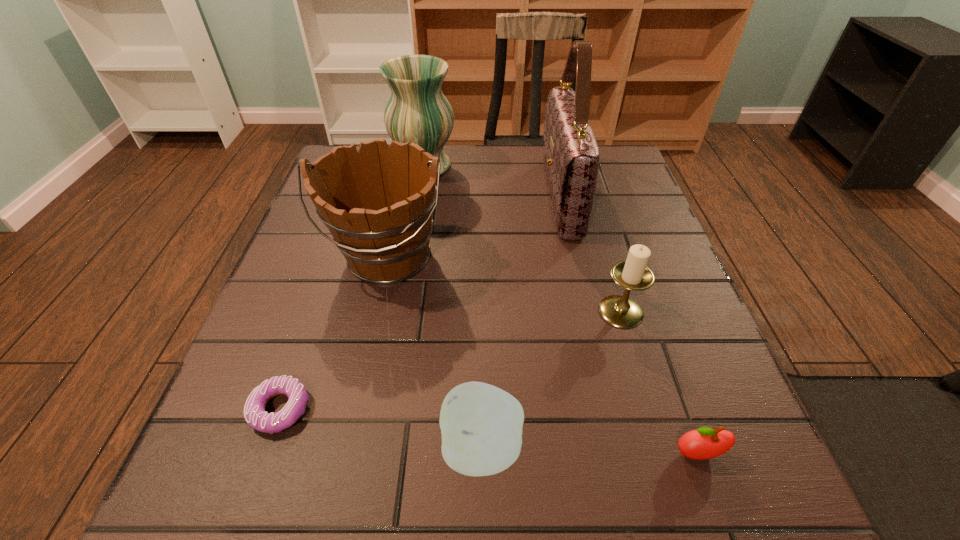
The image size is (960, 540). I want to click on vacant region between the fourth object from left to right and the candle holder, so click(551, 380).

Where is `free space between the left apple and the doughnut`? The height and width of the screenshot is (540, 960). free space between the left apple and the doughnut is located at coordinates (381, 429).

Identify the location of free space between the fifth tallest object and the right apple. (589, 451).

What are the coordinates of `free space between the handbag and the fourth object from left to right` in the screenshot? It's located at (521, 322).

Where is `object that stands as the third closest to the shortest object`? Image resolution: width=960 pixels, height=540 pixels. object that stands as the third closest to the shortest object is located at coordinates (633, 274).

At what (x,y) coordinates should I click in order to perform the action: click on object that stands as the fifth closest to the wine bucket. Please return your answer as a coordinate pair (x, y). This screenshot has height=540, width=960. Looking at the image, I should click on (633, 274).

Where is `vacant space that satisfies the following two spatial constraints: 1. with the handle on the wine bucket; 2. on the right side of the left apple`? The image size is (960, 540). vacant space that satisfies the following two spatial constraints: 1. with the handle on the wine bucket; 2. on the right side of the left apple is located at coordinates (346, 448).

In order to click on free point that satisfies the following two spatial constraints: 1. on the front of the tallest object with the clasp; 2. on the back side of the fourth shortest object in this screenshot , I will do `click(587, 312)`.

Find the location of a particular element. vacant space that satisfies the following two spatial constraints: 1. on the back side of the shorter apple; 2. on the front of the handbag with the clasp is located at coordinates (607, 197).

The width and height of the screenshot is (960, 540). I want to click on free region that satisfies the following two spatial constraints: 1. with the handle on the wine bucket; 2. on the left side of the fourth object from right to left, so click(x=346, y=448).